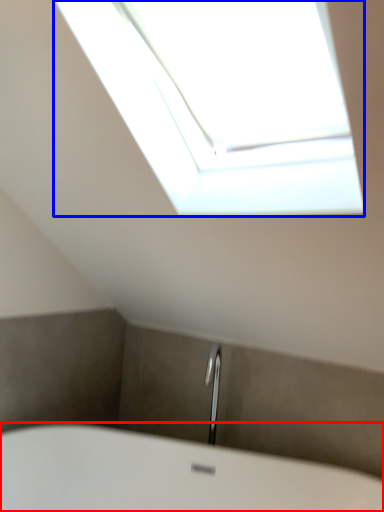
Question: Which of the following is the closest to the observer, bathtub (highlighted by a red box) or window (highlighted by a blue box)?

Choices:
 (A) bathtub
 (B) window

Answer: (B)